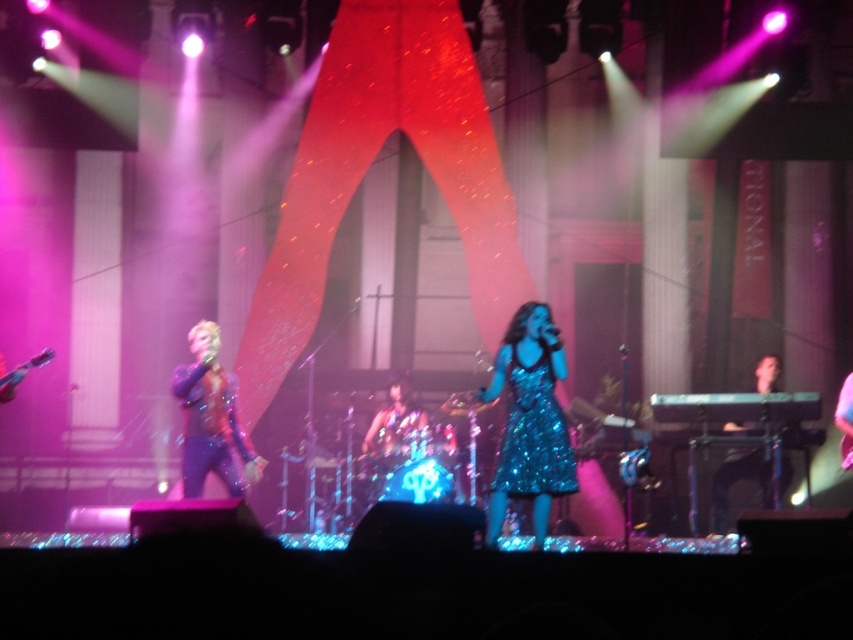
Is sparkly blue dress at center behind black glossy keyboard at right?

That is False.

Which is in front, point (538, 422) or point (724, 484)?

Point (538, 422) is in front.

You are a GUI agent. You are given a task and a screenshot of the screen. Output one action in this format:
    pyautogui.click(x=<x>, y=<y>)
    Task: Click on the sparkly blue dress at center
    The image size is (853, 640).
    Given the screenshot: What is the action you would take?
    pyautogui.click(x=532, y=433)

Is black glossy keyboard at right thinner than shiny blue dress at center?

No.

Which is in front, point (720, 490) or point (374, 416)?

Point (720, 490)

The width and height of the screenshot is (853, 640). Identify the location of black glossy keyboard at right. (738, 480).

Is sparkly purple dress at left bigger than sparkly blue dress at center?

Yes, sparkly purple dress at left is bigger than sparkly blue dress at center.

Is sparkly purple dress at left shorter than sparkly blue dress at center?

No.

Where is `sparkly purple dress at left`? The width and height of the screenshot is (853, 640). sparkly purple dress at left is located at coordinates (212, 419).